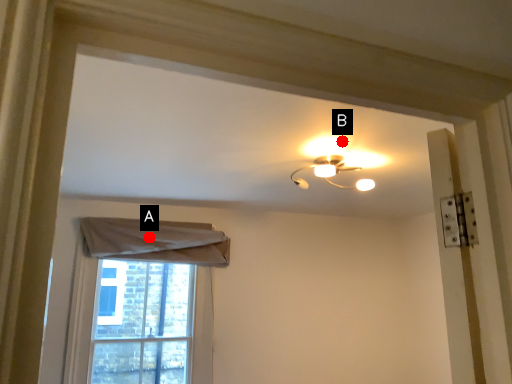
Question: Two points are circled on the image, labeled by A and B beside each circle. Which of the following is the closest to the observer?

Choices:
 (A) A is closer
 (B) B is closer

Answer: (B)